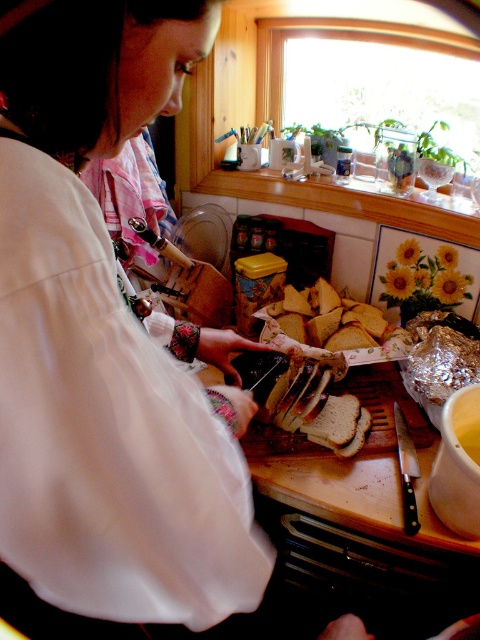
Question: Among these objects, which one is farthest from the camera?

Choices:
 (A) wooden at center
 (B) white matte shirt at center

Answer: (A)

Question: From the image, what is the correct spatial relationship of white matte shirt at center in relation to wooden at center?

Choices:
 (A) right
 (B) left

Answer: (B)

Question: Does white matte shirt at center appear on the right side of wooden at center?

Choices:
 (A) no
 (B) yes

Answer: (A)

Question: In this image, where is white matte shirt at center located relative to wooden at center?

Choices:
 (A) right
 (B) left

Answer: (B)

Question: Which point is closer to the camera taking this photo?

Choices:
 (A) (419, 433)
 (B) (6, 380)

Answer: (B)